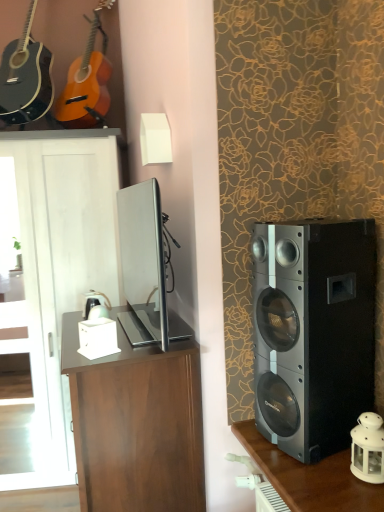
I want to click on free spot in front of white glass lantern at lower right, so [363, 495].